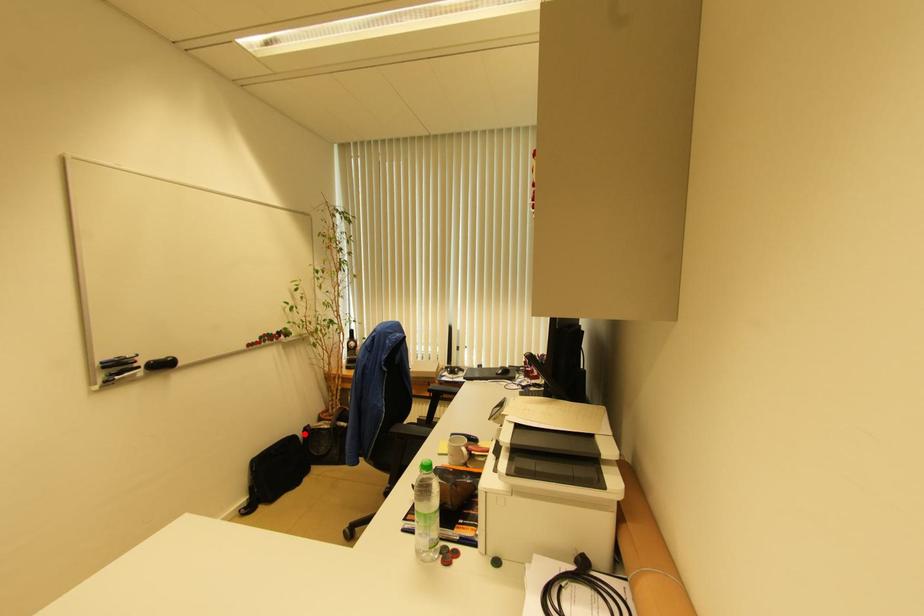
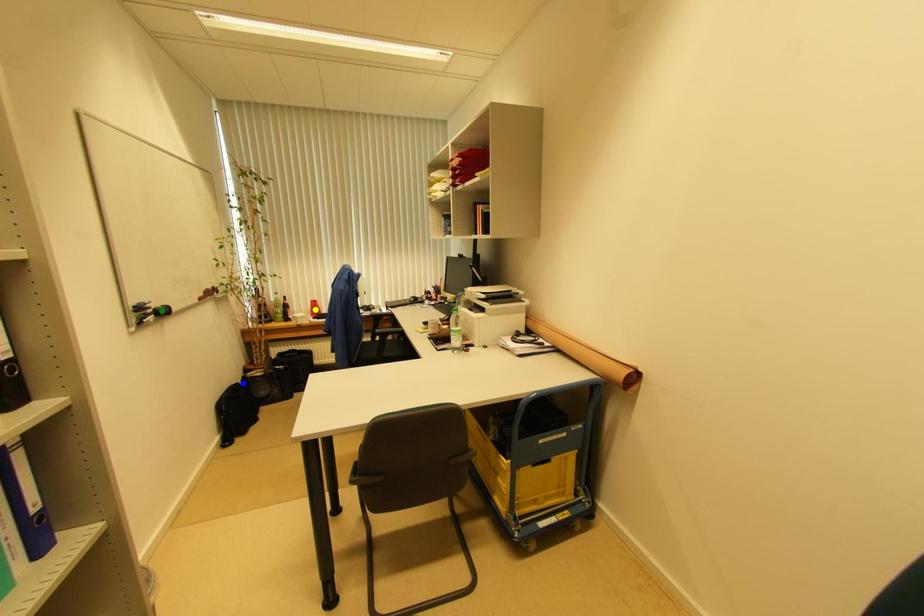
Question: I am providing you with two images of the same scene from different viewpoints. A red point is marked on the first image. You are given multiple points on the second image. Which point in image 2 is actually the same real-world point as the red point in image 1?

Choices:
 (A) green point
 (B) blue point
 (C) yellow point

Answer: (B)